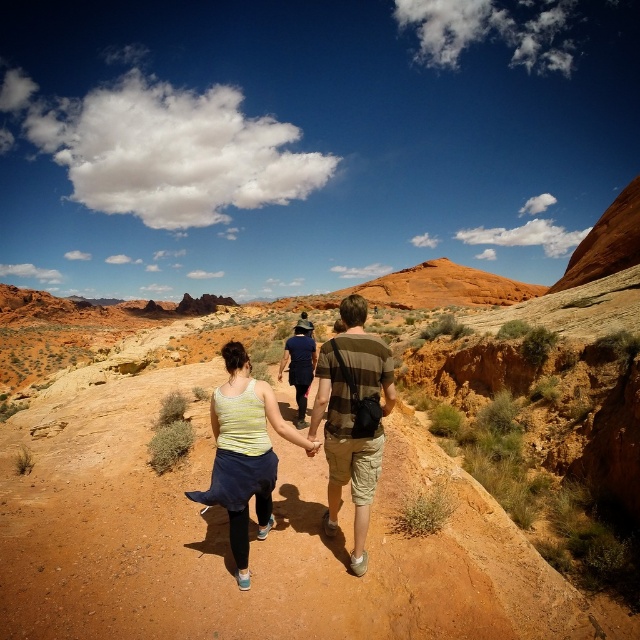
Who is higher up, camouflage shorts at center or yellow-green striped tank top at center?

camouflage shorts at center is above.

Where is `camouflage shorts at center`? The height and width of the screenshot is (640, 640). camouflage shorts at center is located at coordinates (353, 419).

Where is `camouflage shorts at center`? This screenshot has width=640, height=640. camouflage shorts at center is located at coordinates (353, 419).

Identify the location of camouflage shorts at center. Image resolution: width=640 pixels, height=640 pixels. (353, 419).

Measure the distance between yellow-green striped tank top at center and striped cotton shirt at center.

yellow-green striped tank top at center and striped cotton shirt at center are 18.41 meters apart.

Is yellow-green striped tank top at center wider than striped cotton shirt at center?

Correct, the width of yellow-green striped tank top at center exceeds that of striped cotton shirt at center.

At what (x,y) coordinates should I click in order to perform the action: click on yellow-green striped tank top at center. Please return your answer as a coordinate pair (x, y). Looking at the image, I should click on (244, 452).

Locate an element on the screen. This screenshot has height=640, width=640. yellow-green striped tank top at center is located at coordinates (244, 452).

Which of these two, camouflage shorts at center or striped cotton shirt at center, stands shorter?

With less height is striped cotton shirt at center.

Measure the distance between camouflage shorts at center and camera.

camouflage shorts at center is 137.99 feet away from camera.

Find the location of a particular element. This screenshot has width=640, height=640. camouflage shorts at center is located at coordinates (353, 419).